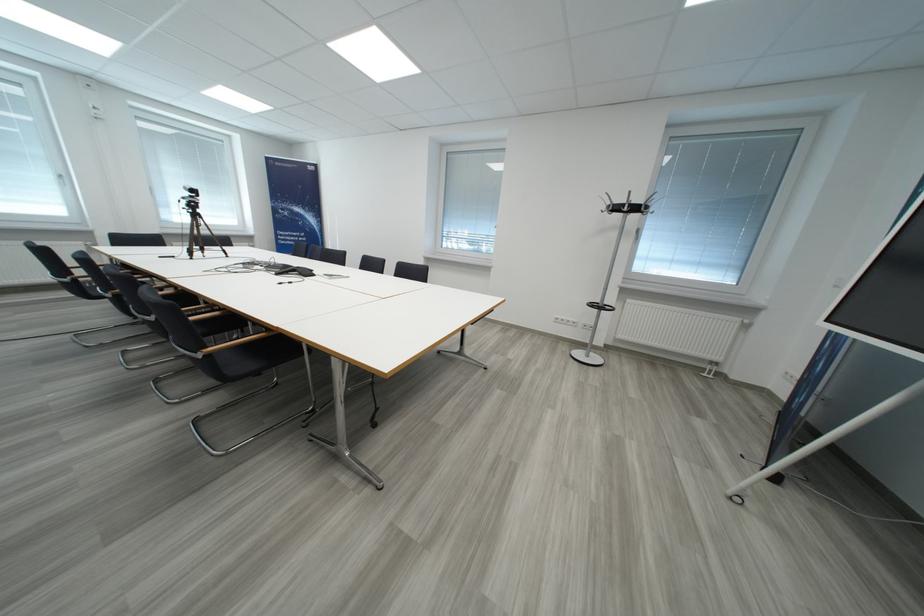
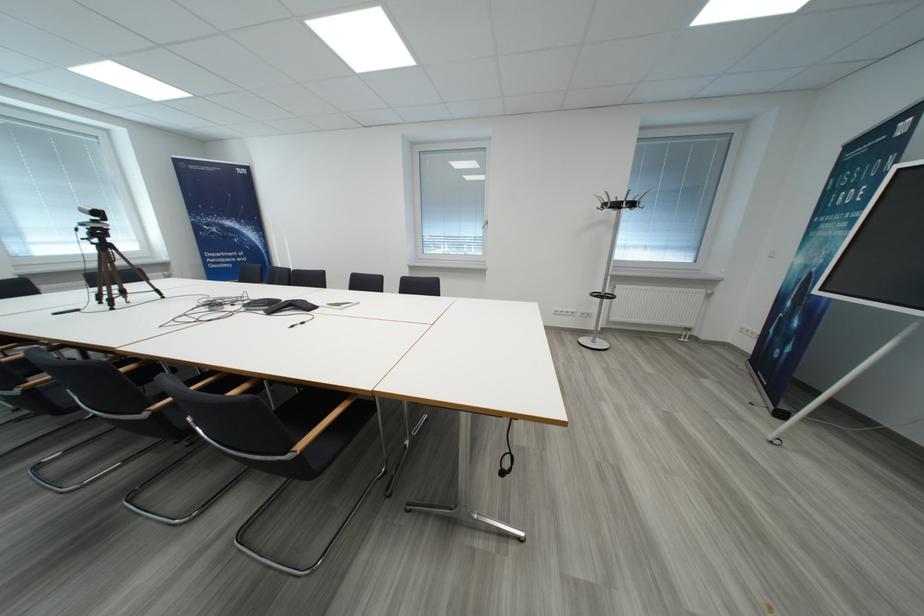
The point at (x=624, y=209) is marked in the first image. Where is the corresponding point in the second image?

(623, 208)